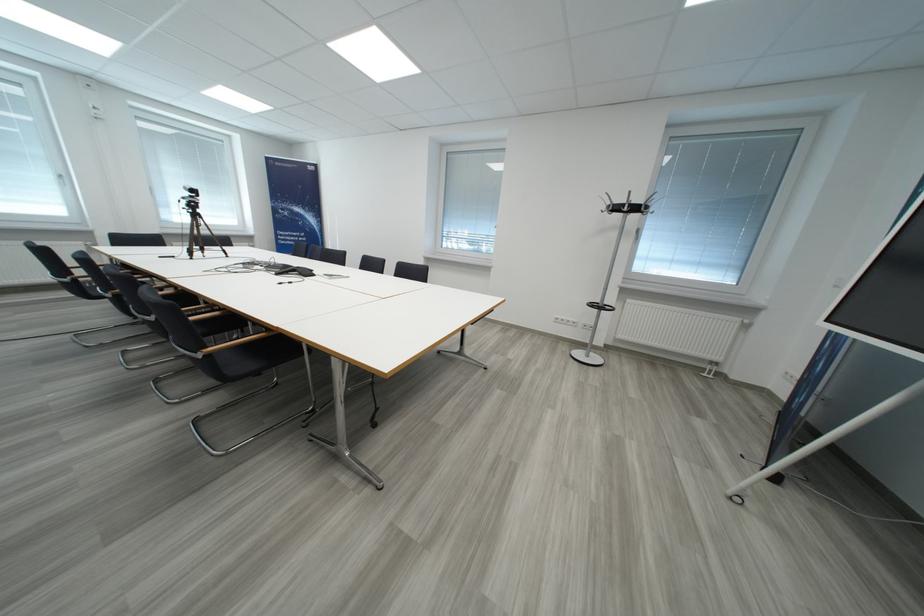
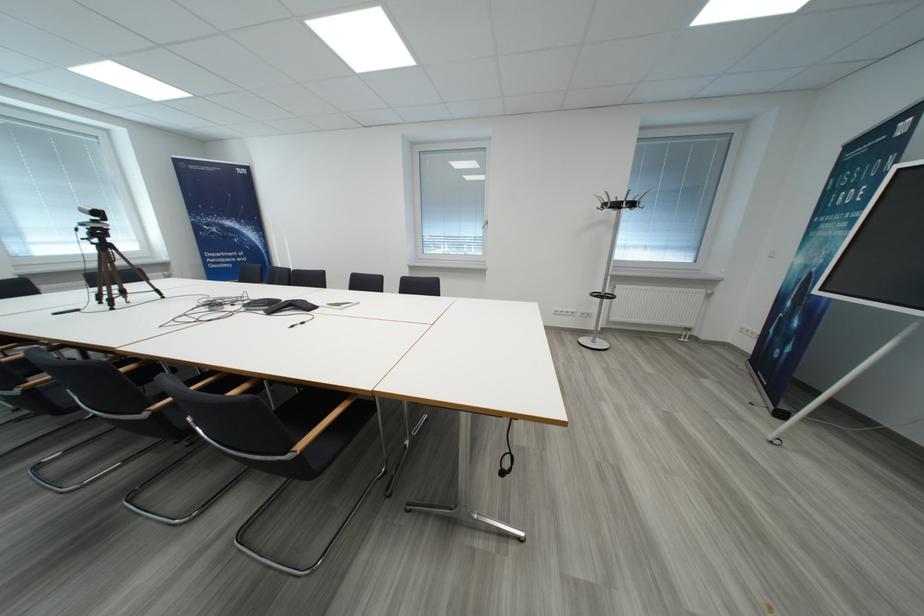
The point at (x=624, y=209) is marked in the first image. Where is the corresponding point in the second image?

(623, 208)